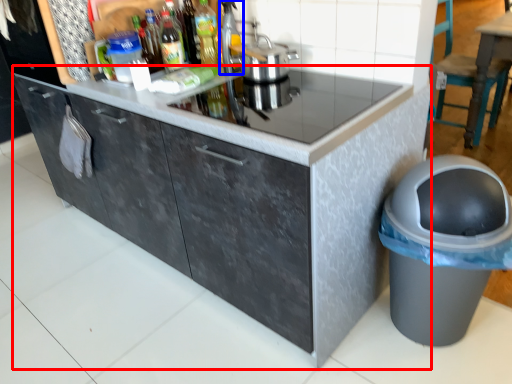
Question: Which object appears closest to the camera in this image, cabinetry (highlighted by a red box) or appliance (highlighted by a blue box)?

Choices:
 (A) cabinetry
 (B) appliance

Answer: (A)